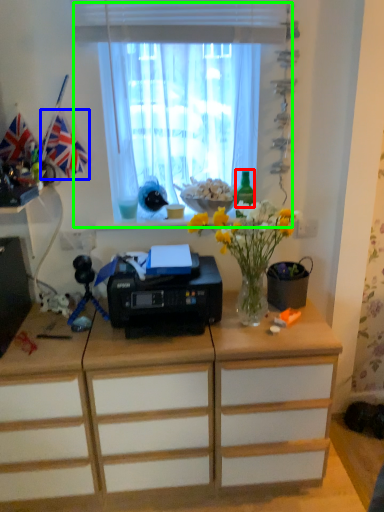
Question: Which object is positioned farthest from bottle (highlighted by a red box)? Select from flag (highlighted by a blue box) and window (highlighted by a green box).

Choices:
 (A) flag
 (B) window

Answer: (A)